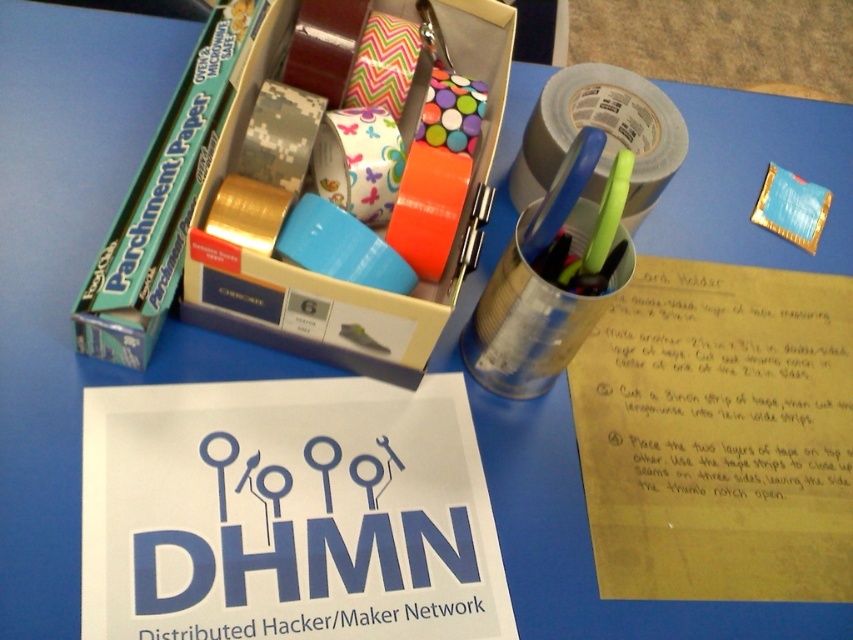
Question: Considering the real-world distances, which object is farthest from the silver metallic tape at upper center?

Choices:
 (A) metallic tin canister at center-right
 (B) blue foil wrapper at upper right
 (C) matte cardboard box at center

Answer: (B)

Question: Which of these objects is positioned closest to the metallic tin canister at center-right?

Choices:
 (A) matte cardboard box at center
 (B) silver metallic tape at upper center
 (C) blue foil wrapper at upper right

Answer: (A)

Question: Does matte cardboard box at center appear under blue foil wrapper at upper right?

Choices:
 (A) no
 (B) yes

Answer: (A)

Question: Based on their relative distances, which object is farther from the metallic tin canister at center-right?

Choices:
 (A) matte cardboard box at center
 (B) blue foil wrapper at upper right

Answer: (B)

Question: Can you confirm if matte cardboard box at center is bigger than metallic tin canister at center-right?

Choices:
 (A) no
 (B) yes

Answer: (B)

Question: Is metallic tin canister at center-right further to camera compared to silver metallic tape at upper center?

Choices:
 (A) yes
 (B) no

Answer: (B)